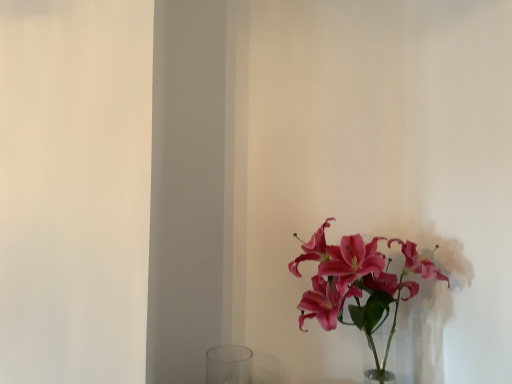
At what (x,y) coordinates should I click in order to perform the action: click on pink glossy flowers at upper right. Please return your answer as a coordinate pair (x, y). Looking at the image, I should click on (357, 280).

The width and height of the screenshot is (512, 384). What do you see at coordinates (357, 280) in the screenshot?
I see `pink glossy flowers at upper right` at bounding box center [357, 280].

At what (x,y) coordinates should I click in order to perform the action: click on pink glossy flowers at upper right. Please return your answer as a coordinate pair (x, y). The height and width of the screenshot is (384, 512). Looking at the image, I should click on (357, 280).